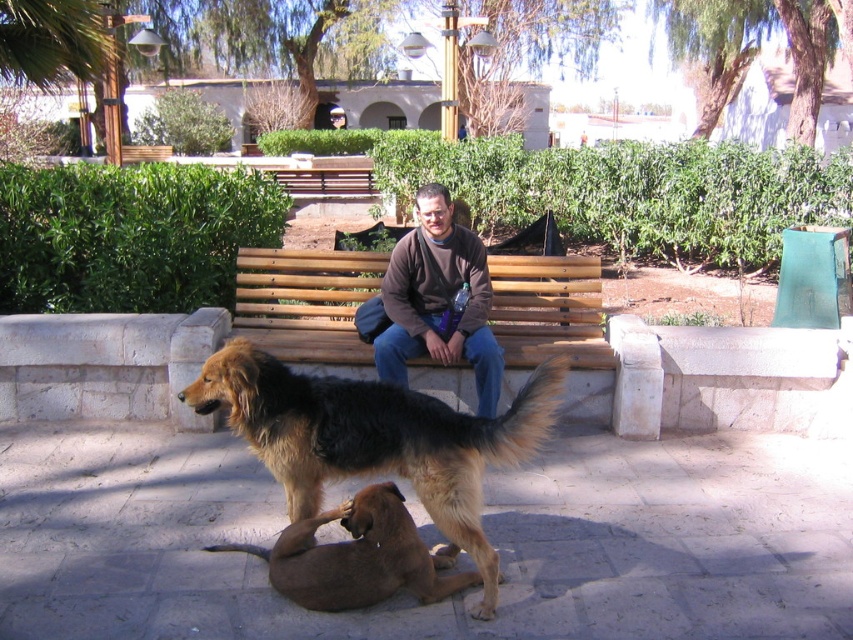
You are a photographer trying to capture both the brown fur dog at center and the brown soft sweater at center in a single shot. Which object should you focus on first to ensure both are in frame?

The brown fur dog at center is bigger than the brown soft sweater at center, so you should focus on the brown fur dog at center first to ensure both fit within the frame.

Looking at this image, you are a photographer trying to capture a photo of both the brown fur dog at center and the brown soft sweater at center. Since you want them both in the frame, can you tell me which one is on the left side so you can adjust your camera accordingly?

The brown fur dog at center is positioned on the left side of brown soft sweater at center, so you should adjust your camera to ensure both are in frame with the dog on the left and the sweater on the right.

You are standing in the park and want to walk from point A to point B. Point A is at coordinates point [340,321] and point B is at coordinates point [355,554]. Since you want to take the shortest path possible, which direction should you head towards from point A to reach point B?

Since point [340,321] is further to the viewer than point [355,554], you should head towards the direction away from you to reach point B from point A.